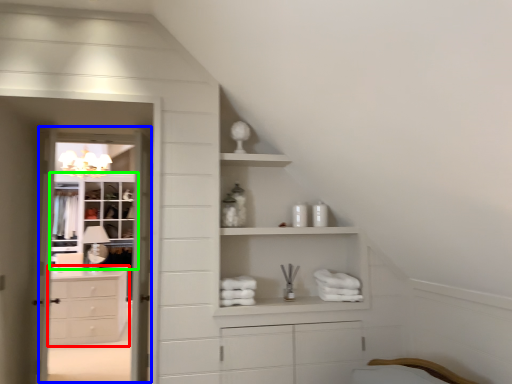
Question: Which object is positioned farthest from chest of drawers (highlighted by a red box)? Select from screen door (highlighted by a blue box) and cupboard (highlighted by a green box).

Choices:
 (A) screen door
 (B) cupboard

Answer: (A)